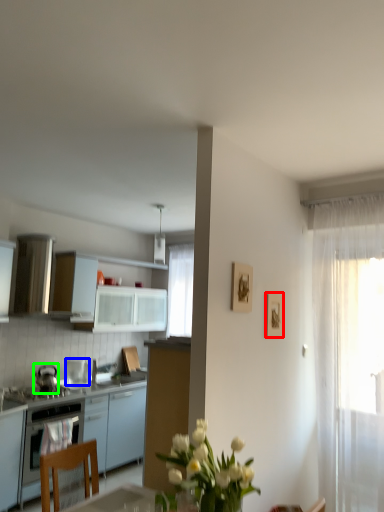
Question: Which object is positioned closest to picture frame (highlighted by a red box)? Select from kitchen appliance (highlighted by a blue box) and kitchen appliance (highlighted by a green box).

Choices:
 (A) kitchen appliance
 (B) kitchen appliance

Answer: (B)